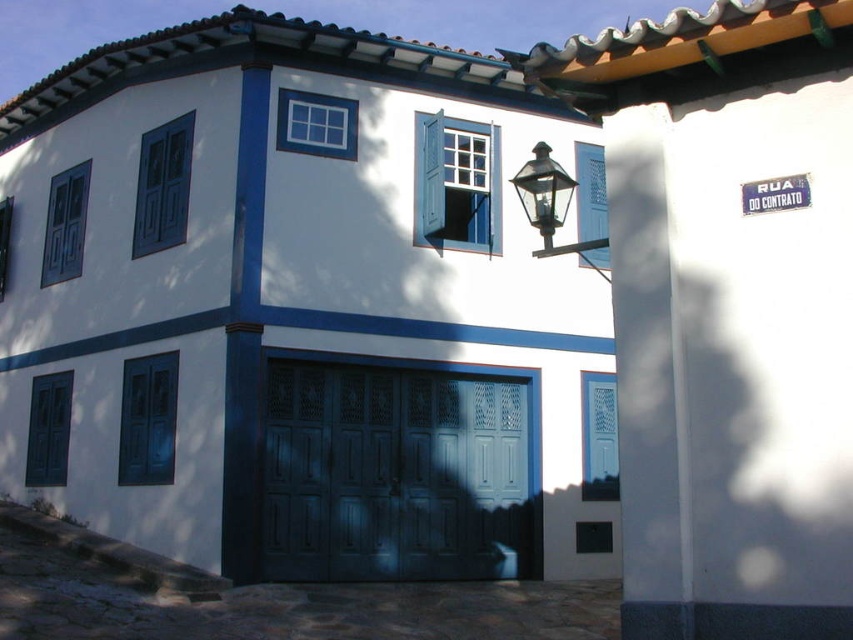
Does point (184, 209) come farther from viewer compared to point (47, 404)?

No.

Is blue painted wood shutter at upper left above blue painted wood shutter at lower left?

Yes, blue painted wood shutter at upper left is above blue painted wood shutter at lower left.

The height and width of the screenshot is (640, 853). What do you see at coordinates (161, 186) in the screenshot? I see `blue painted wood shutter at upper left` at bounding box center [161, 186].

I want to click on blue painted wood shutter at upper left, so click(161, 186).

Can you confirm if blue painted wood shutter at upper center is taller than white wooden shutter at center?

Yes.

From the picture: Who is more distant from viewer, [479,205] or [592,436]?

Positioned behind is point [479,205].

You are a GUI agent. You are given a task and a screenshot of the screen. Output one action in this format:
    pyautogui.click(x=<x>, y=<y>)
    Task: Click on the blue painted wood shutter at upper center
    The height and width of the screenshot is (640, 853).
    Given the screenshot: What is the action you would take?
    pyautogui.click(x=456, y=182)

Between blue painted wood shutter at upper center and blue matte door at lower left, which one has more height?

Standing taller between the two is blue painted wood shutter at upper center.

Based on the photo, can you confirm if blue painted wood shutter at upper center is bigger than blue matte door at lower left?

Yes.

Which is behind, point (479, 148) or point (160, 428)?

Positioned behind is point (479, 148).

You are a GUI agent. You are given a task and a screenshot of the screen. Output one action in this format:
    pyautogui.click(x=<x>, y=<y>)
    Task: Click on the blue painted wood shutter at upper center
    The width and height of the screenshot is (853, 640).
    Given the screenshot: What is the action you would take?
    pyautogui.click(x=456, y=182)